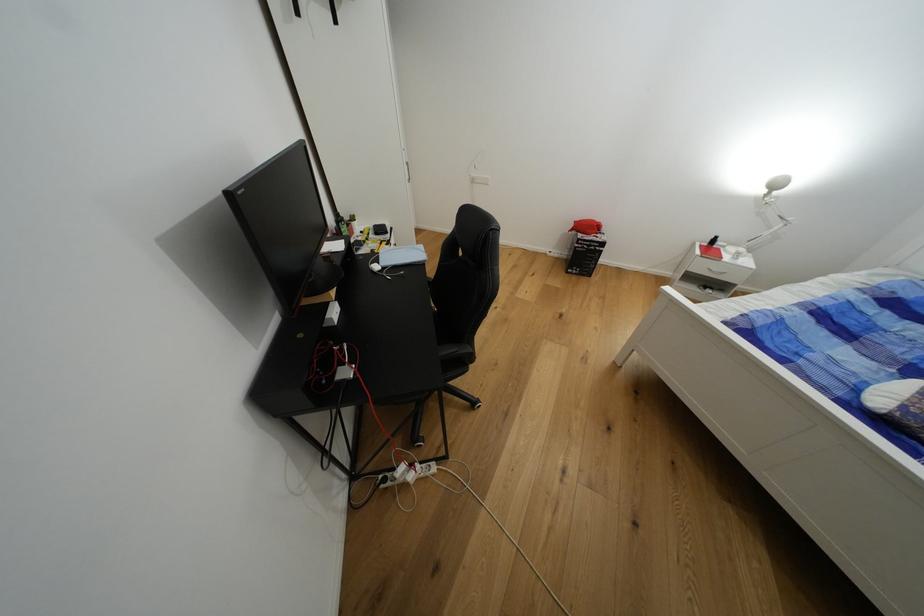
The width and height of the screenshot is (924, 616). I want to click on bedside drawer handle, so click(x=715, y=273).